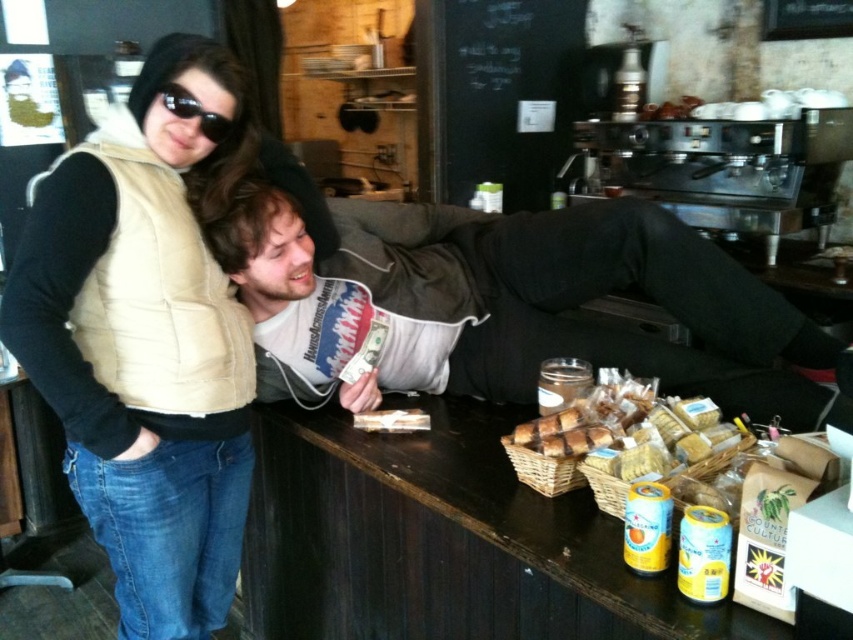
You are standing at point (457, 16) and want to move to point (308, 225). Is there a clear path between these two points?

Yes, since point (308, 225) is in front of point (457, 16), there is a clear path between them.

You are a painter who needs to reach both the black chalkboard at upper center and the black matte sunglasses at upper left. Your ladder can only extend to 1.7 meters. Can you safely reach both objects without adjusting the ladder height?

The distance between the black chalkboard at upper center and the black matte sunglasses at upper left is 1.88 meters. Since your ladder extends only 1.7 meters, you cannot safely reach both objects without adjusting the ladder height.